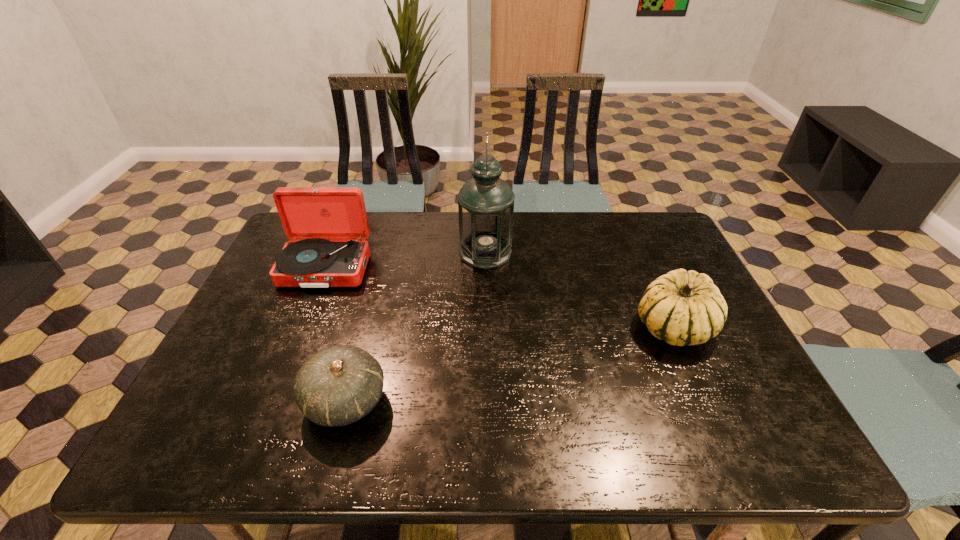
The height and width of the screenshot is (540, 960). Find the location of `vacant region located 0.350m on the back of the shortest object`. vacant region located 0.350m on the back of the shortest object is located at coordinates (379, 272).

Where is `oil lamp that is at the far edge`? oil lamp that is at the far edge is located at coordinates (485, 203).

Identify the location of phonograph_record that is positioned at the far edge. This screenshot has height=540, width=960. (327, 226).

Find the location of a particular element. The image size is (960, 540). object positioned at the near edge is located at coordinates 338,385.

Locate an element on the screen. object located at the left edge is located at coordinates (327, 226).

Where is `object positioned at the right edge`? object positioned at the right edge is located at coordinates (682, 307).

Locate an element on the screen. This screenshot has height=540, width=960. object present at the far left corner is located at coordinates (327, 226).

Find the location of a particular element. free space at the far edge of the desktop is located at coordinates (394, 249).

In the image, there is a desktop. At what (x,y) coordinates should I click in order to perform the action: click on vacant space at the near edge. Please return your answer as a coordinate pair (x, y). The width and height of the screenshot is (960, 540). Looking at the image, I should click on (333, 454).

Find the location of `vacant space at the left edge of the desktop`. vacant space at the left edge of the desktop is located at coordinates (218, 352).